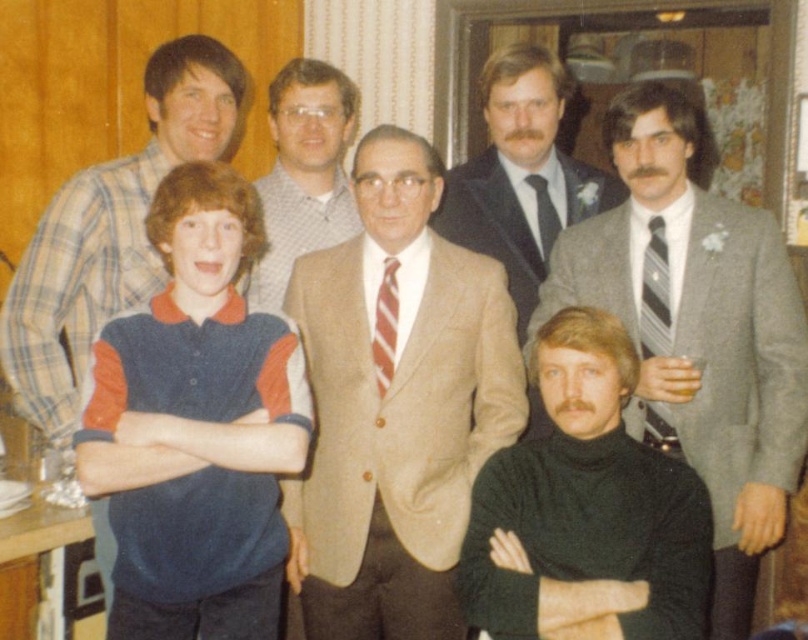
You are standing at the point labeled point (133,604) and want to reach the door located at the back of the room. The minimum distance you need to walk is 1.79 meters. Is there enough space between you and the door to walk through comfortably?

The distance between you and the door is 1.79 meters. Since the required minimum distance is 1.79 meters, there is exactly enough space to walk through comfortably without any obstruction.

You are standing in the room where the photo was taken and want to move from the point at coordinates point (381,404) to the point at coordinates point (621,470). Which direction should you move to get closer to the camera?

You should move towards the point at coordinates point (621,470) because it is closer to the camera than point (381,404).